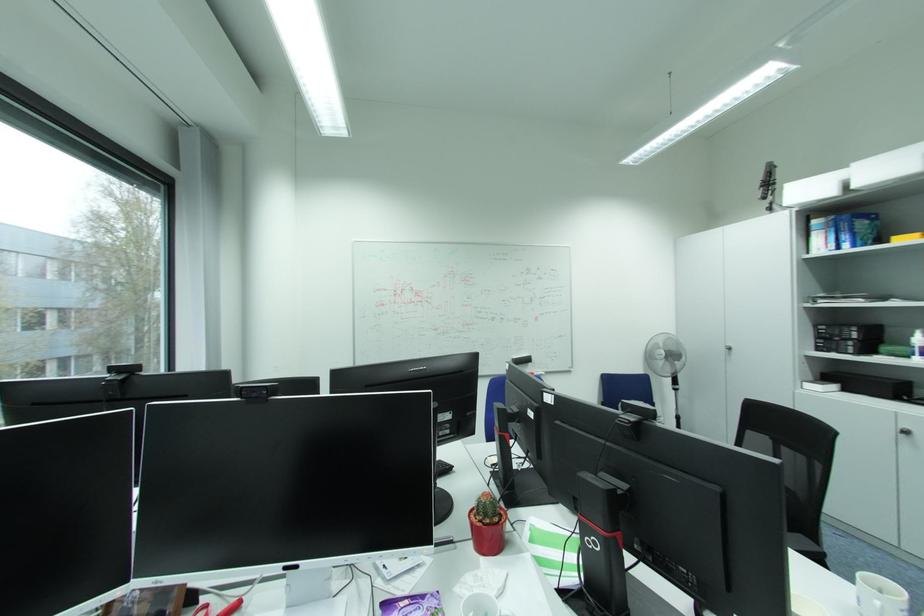
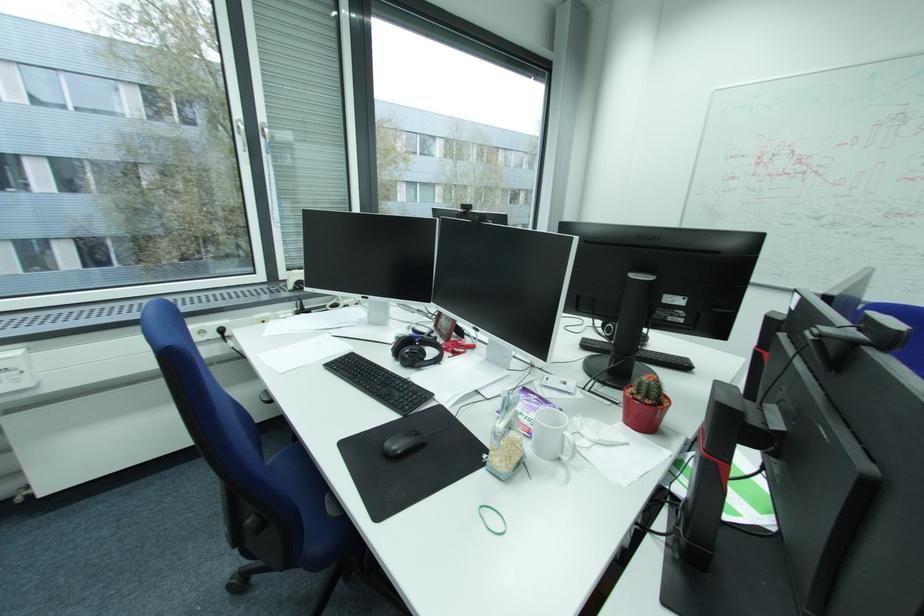
Where in the second image is the point corresponding to pixel 306 567 from the first image?

(487, 331)